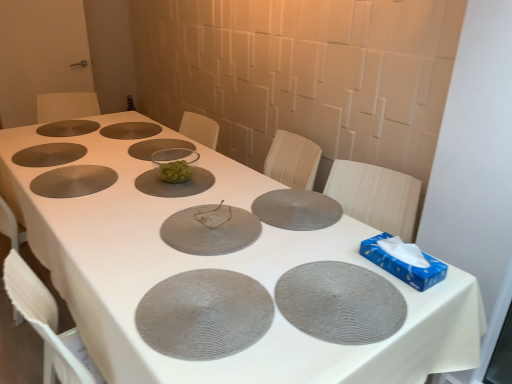
Where is `free space in front of matte gray glass plate at upper left, the 10th glass plate positioned from the front`? The image size is (512, 384). free space in front of matte gray glass plate at upper left, the 10th glass plate positioned from the front is located at coordinates (41, 138).